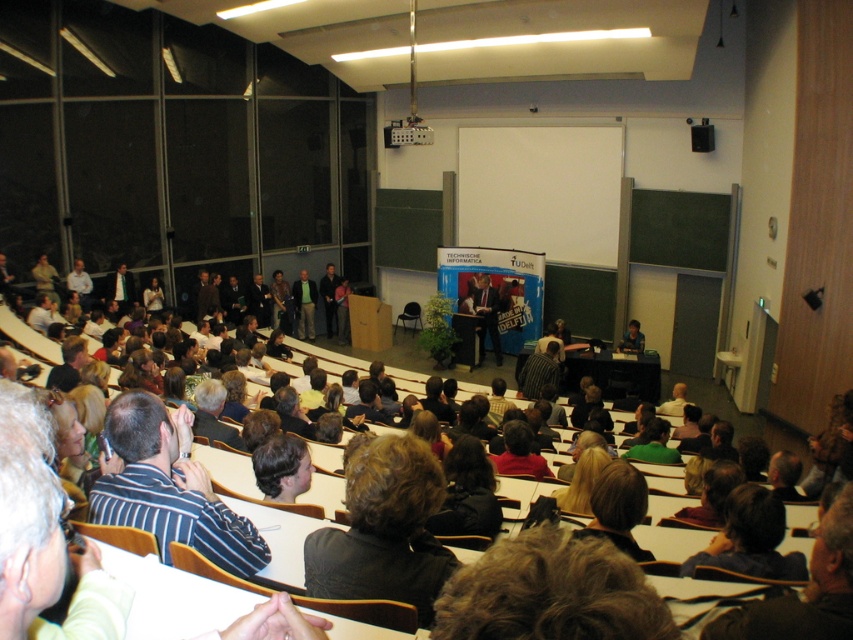
Question: Which of the following is the farthest from the observer?

Choices:
 (A) dark blue suit at center
 (B) striped fabric shirt at lower left

Answer: (A)

Question: Among these points, which one is nearest to the camera?

Choices:
 (A) (477, 336)
 (B) (297, 292)

Answer: (A)

Question: Is striped fabric shirt at lower left bigger than dark blue suit at center?

Choices:
 (A) no
 (B) yes

Answer: (A)

Question: Is dark blue suit at center bigger than green fabric shirt at center?

Choices:
 (A) yes
 (B) no

Answer: (A)

Question: Which point is farther to the camera?

Choices:
 (A) (498, 340)
 (B) (291, 289)

Answer: (B)

Question: Observing the image, what is the correct spatial positioning of striped fabric shirt at lower left in reference to green fabric shirt at center?

Choices:
 (A) left
 (B) right

Answer: (B)